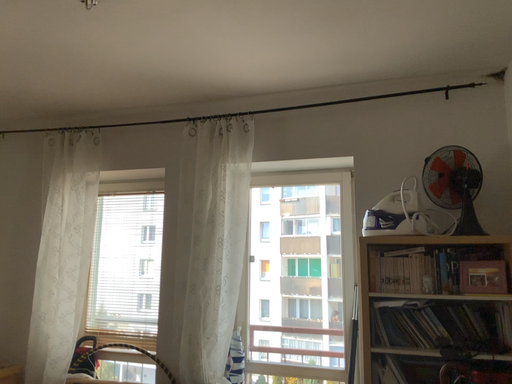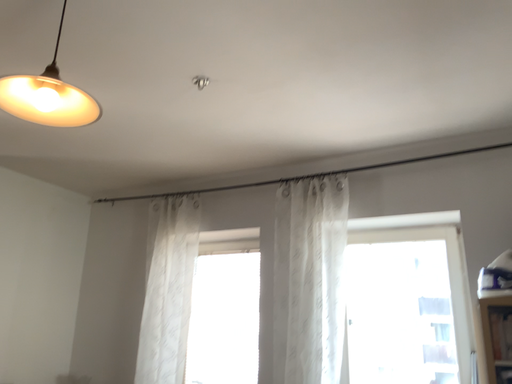
Question: Which way did the camera rotate in the video?

Choices:
 (A) rotated right
 (B) rotated left

Answer: (B)